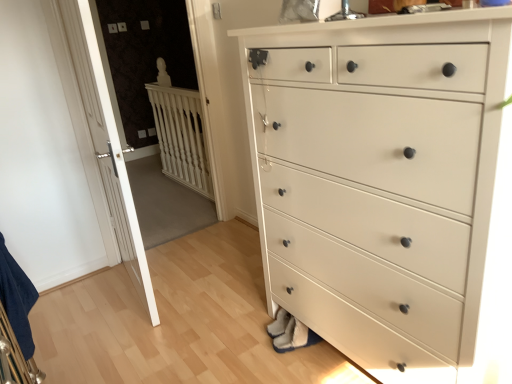
Image resolution: width=512 pixels, height=384 pixels. In order to click on free spot behind white wooden door at left in this screenshot , I will do `click(175, 252)`.